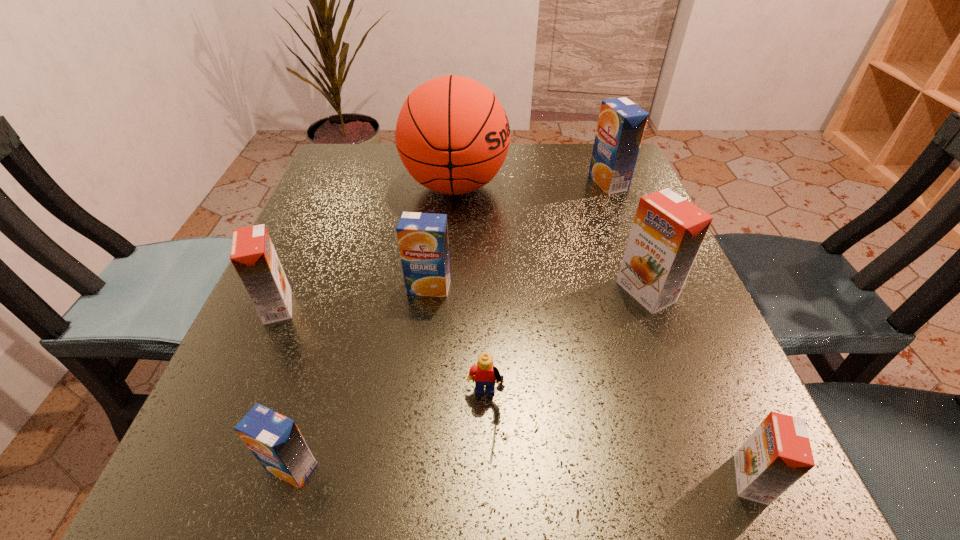
I want to click on vacant space at the far left corner, so click(x=376, y=145).

I want to click on free spot between the smallest orange orange juice and the Lego, so click(618, 441).

This screenshot has height=540, width=960. I want to click on vacant space that's between the farthest orange juice and the biggest orange orange juice, so click(627, 237).

In order to click on vacant region between the nearest orange orange juice and the biggest orange orange juice in this screenshot , I will do `click(698, 386)`.

I want to click on free space between the biggest orange orange juice and the third nearest object, so click(x=565, y=348).

At what (x,y) coordinates should I click in order to perform the action: click on free space between the leftmost blue orange_juice and the smallest orange orange juice. Please return your answer as a coordinate pair (x, y). Looking at the image, I should click on (521, 473).

Find the location of `vacant region between the nearest blue orange_juice and the yellow Lego`. vacant region between the nearest blue orange_juice and the yellow Lego is located at coordinates (389, 435).

Find the location of a particular element. The width and height of the screenshot is (960, 540). free spot between the Lego and the second biggest orange orange juice is located at coordinates [x=382, y=355].

At what (x,y) coordinates should I click in order to perform the action: click on vacant area that lies between the rightmost blue orange_juice and the Lego. Please return your answer as a coordinate pair (x, y). Image resolution: width=960 pixels, height=540 pixels. Looking at the image, I should click on (547, 293).

You are a GUI agent. You are given a task and a screenshot of the screen. Output one action in this format:
    pyautogui.click(x=<x>, y=<y>)
    Task: Click on the unoccupied area between the tallest object and the nearest blue orange_juice
    Image resolution: width=960 pixels, height=540 pixels.
    Given the screenshot: What is the action you would take?
    point(373,327)